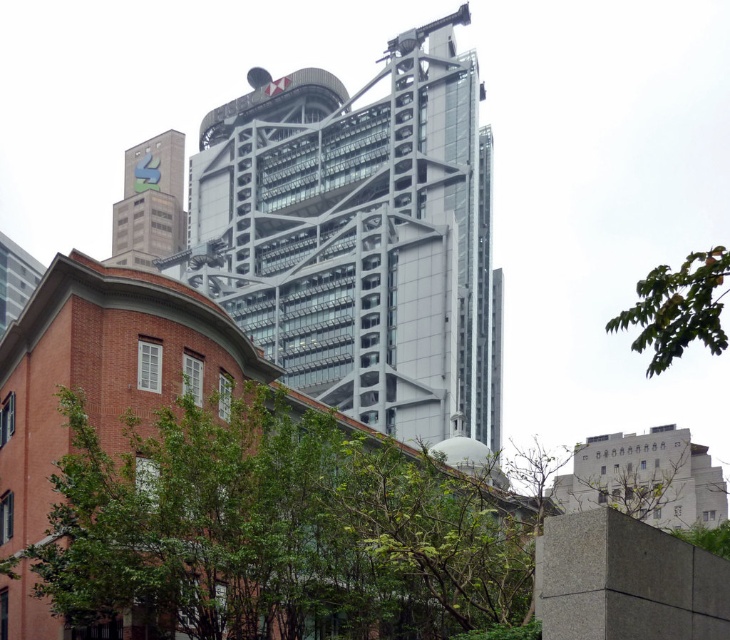
Question: Does green leafy tree at upper right appear on the left side of matte gray building at upper left?

Choices:
 (A) no
 (B) yes

Answer: (A)

Question: Is green leafy tree at upper right wider than matte gray building at upper left?

Choices:
 (A) yes
 (B) no

Answer: (A)

Question: Which point is farther to the camera?

Choices:
 (A) (137, 556)
 (B) (268, 307)

Answer: (B)

Question: Among these points, which one is nearest to the camera?

Choices:
 (A) (161, 561)
 (B) (704, 321)
 (C) (345, 115)

Answer: (B)

Question: Does metallic glass tower at upper center have a larger size compared to matte gray building at upper left?

Choices:
 (A) no
 (B) yes

Answer: (B)

Question: Which point is farther to the camera?

Choices:
 (A) green leafy tree at upper right
 (B) matte gray building at upper left
 (C) green leafy tree at lower left
 (D) metallic glass tower at upper center

Answer: (B)